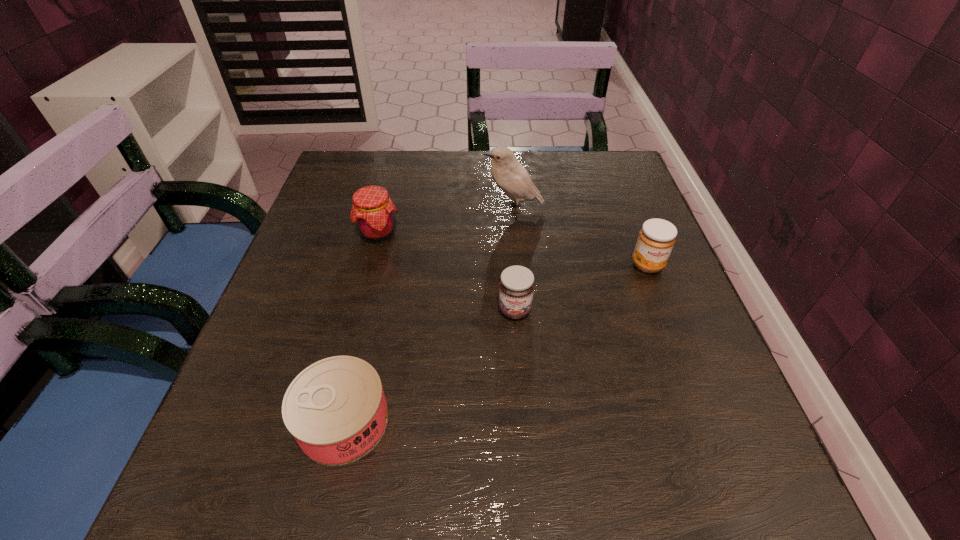
This screenshot has width=960, height=540. I want to click on vacant space located at the beak of the tallest object, so click(420, 208).

This screenshot has height=540, width=960. In order to click on free space located 0.260m at the beak of the tallest object in this screenshot , I will do `click(373, 208)`.

At what (x,y) coordinates should I click in order to perform the action: click on vacant space located at the beak of the tallest object. Please return your answer as a coordinate pair (x, y). Looking at the image, I should click on [319, 208].

Where is `blank area located on the right of the leftmost jam`? This screenshot has height=540, width=960. blank area located on the right of the leftmost jam is located at coordinates (521, 233).

The height and width of the screenshot is (540, 960). I want to click on vacant region located on the front label of the third farthest object, so click(684, 361).

Image resolution: width=960 pixels, height=540 pixels. Identify the location of vacant area situated 0.180m on the front label of the nearest jam. (522, 415).

Identify the location of vacant region located 0.270m on the back of the nearest object. (380, 267).

Where is `object situated at the near edge`? The height and width of the screenshot is (540, 960). object situated at the near edge is located at coordinates (336, 410).

Image resolution: width=960 pixels, height=540 pixels. What are the coordinates of `jam that is at the left edge` in the screenshot? It's located at (372, 210).

At what (x,y) coordinates should I click in order to perform the action: click on can positioned at the left edge. Please return your answer as a coordinate pair (x, y). This screenshot has width=960, height=540. Looking at the image, I should click on (336, 410).